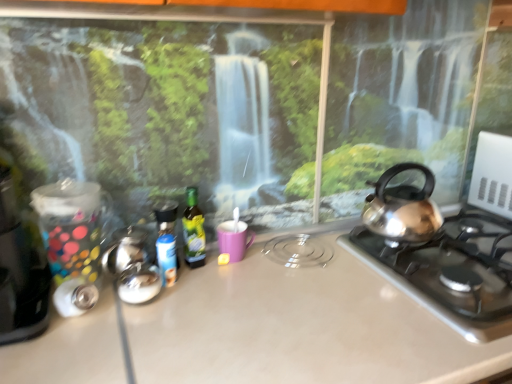
Identify the location of free location to the right of matte purple mug at center. The image size is (512, 384). (289, 261).